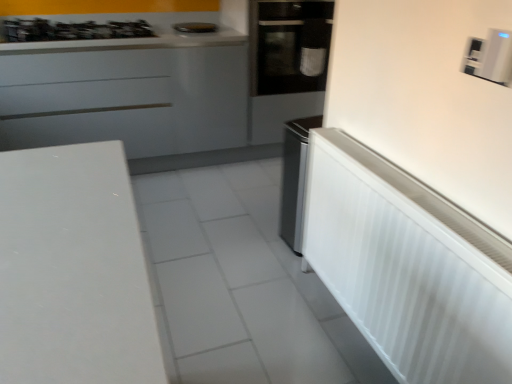
The image size is (512, 384). Identify the location of white plastic radiator at right, positioned as the 3th appliance in top-to-bottom order. (408, 267).

Image resolution: width=512 pixels, height=384 pixels. Describe the element at coordinates (490, 57) in the screenshot. I see `white plastic thermostat at upper right, the third appliance when ordered from left to right` at that location.

In order to face metallic silver gas stove at upper left, should I rotate leftwards or rightwards?

Turn left by 22.820 degrees to look at metallic silver gas stove at upper left.

What do you see at coordinates (72, 30) in the screenshot? This screenshot has height=384, width=512. I see `metallic silver gas stove at upper left` at bounding box center [72, 30].

Identify the location of metallic silver toaster at upper center, the 1th appliance from the left. This screenshot has width=512, height=384. (195, 28).

Locate an element on the screen. This screenshot has height=384, width=512. white plastic radiator at right, which appears as the 1th appliance when ordered from the bottom is located at coordinates (408, 267).

Is white plastic thermostat at upper right, which is the second appliance from front to back, at the left side of white glossy cabinet at upper left?

No.

Is white plastic thermostat at upper right, placed as the 2th appliance when sorted from bottom to top, far away from white glossy cabinet at upper left?

white plastic thermostat at upper right, placed as the 2th appliance when sorted from bottom to top, is far away from white glossy cabinet at upper left.

There is a white glossy cabinet at upper left. Where is `the 1st appliance below it (from the image's perspective)`? Image resolution: width=512 pixels, height=384 pixels. the 1st appliance below it (from the image's perspective) is located at coordinates (490, 57).

Would you say white plastic radiator at right, the third appliance positioned from the back, is outside metallic silver gas stove at upper left?

Yes, white plastic radiator at right, the third appliance positioned from the back, is outside of metallic silver gas stove at upper left.

From their relative heights in the image, would you say white plastic radiator at right, the second appliance in the right-to-left sequence, is taller or shorter than metallic silver gas stove at upper left?

white plastic radiator at right, the second appliance in the right-to-left sequence, is taller than metallic silver gas stove at upper left.

Can you confirm if white plastic radiator at right, the third appliance positioned from the back, is thinner than metallic silver gas stove at upper left?

Correct, the width of white plastic radiator at right, the third appliance positioned from the back, is less than that of metallic silver gas stove at upper left.

Does white plastic radiator at right, the third appliance positioned from the back, appear on the left side of metallic silver gas stove at upper left?

No, white plastic radiator at right, the third appliance positioned from the back, is not to the left of metallic silver gas stove at upper left.

Which object is wider, white plastic radiator at right, the second appliance in the right-to-left sequence, or black glass oven at center?

With larger width is black glass oven at center.

Is the surface of white plastic radiator at right, which appears as the 2th appliance when viewed from the left, in direct contact with black glass oven at center?

They are not placed beside each other.

From the image's perspective, between white plastic radiator at right, positioned as the 3th appliance in top-to-bottom order, and black glass oven at center, who is located below?

white plastic radiator at right, positioned as the 3th appliance in top-to-bottom order, is shown below in the image.

Is metallic silver gas stove at upper left not within white glossy cabinet at upper left?

No, metallic silver gas stove at upper left is not outside of white glossy cabinet at upper left.

Considering the relative positions of metallic silver gas stove at upper left and white glossy cabinet at upper left in the image provided, is metallic silver gas stove at upper left behind white glossy cabinet at upper left?

Yes, metallic silver gas stove at upper left is behind white glossy cabinet at upper left.

Is metallic silver gas stove at upper left oriented towards white glossy cabinet at upper left?

No.

Can you tell me how much black glass oven at center and metallic silver gas stove at upper left differ in facing direction?

The facing directions of black glass oven at center and metallic silver gas stove at upper left are 0.705 degrees apart.

Consider the image. Is black glass oven at center further to camera compared to metallic silver gas stove at upper left?

Yes, black glass oven at center is behind metallic silver gas stove at upper left.

From the image's perspective, is black glass oven at center over metallic silver gas stove at upper left?

Correct, black glass oven at center appears higher than metallic silver gas stove at upper left in the image.

Find the location of a particular element. The height and width of the screenshot is (384, 512). appliance that is the 1st object located below the black glass oven at center (from the image's perspective) is located at coordinates (490, 57).

Are black glass oven at center and white plastic thermostat at upper right, the second appliance positioned from the back, making contact?

No, black glass oven at center is not touching white plastic thermostat at upper right, the second appliance positioned from the back.

Between black glass oven at center and white plastic thermostat at upper right, the second appliance positioned from the back, which one has more height?

With more height is black glass oven at center.

Who is smaller, black glass oven at center or white plastic thermostat at upper right, the second appliance positioned from the back?

Smaller between the two is white plastic thermostat at upper right, the second appliance positioned from the back.

From a real-world perspective, is white plastic thermostat at upper right, which is the second appliance from front to back, physically located above or below metallic silver gas stove at upper left?

white plastic thermostat at upper right, which is the second appliance from front to back, is above metallic silver gas stove at upper left.

Is point (472, 75) in front of point (143, 22)?

Yes, point (472, 75) is closer to viewer.

Is metallic silver gas stove at upper left completely or partially inside white plastic thermostat at upper right, the second appliance in the top-to-bottom sequence?

Actually, metallic silver gas stove at upper left is outside white plastic thermostat at upper right, the second appliance in the top-to-bottom sequence.

Between white plastic thermostat at upper right, the third appliance when ordered from left to right, and metallic silver gas stove at upper left, which one appears on the left side from the viewer's perspective?

metallic silver gas stove at upper left.

Starting from the white glossy cabinet at upper left, which appliance is the 1st one in front? Please provide its 2D coordinates.

[(490, 57)]

Starting from the metallic silver gas stove at upper left, which appliance is the 2nd one to the right? Please provide its 2D coordinates.

[(408, 267)]

Which object lies further to the anchor point white glossy cabinet at upper left, white plastic radiator at right, which appears as the 1th appliance when ordered from the bottom, or white plastic thermostat at upper right, the second appliance in the top-to-bottom sequence?

white plastic thermostat at upper right, the second appliance in the top-to-bottom sequence, lies further to white glossy cabinet at upper left than the other object.

When comparing their distances from white plastic radiator at right, which ranks as the 1th appliance in front-to-back order, does metallic silver gas stove at upper left or metallic silver toaster at upper center, arranged as the third appliance when ordered from the bottom, seem further?

Among the two, metallic silver gas stove at upper left is located further to white plastic radiator at right, which ranks as the 1th appliance in front-to-back order.

Looking at the image, which one is located further to metallic silver toaster at upper center, arranged as the third appliance when ordered from the bottom, white plastic thermostat at upper right, the second appliance positioned from the back, or black glass oven at center?

white plastic thermostat at upper right, the second appliance positioned from the back, is positioned further to the anchor metallic silver toaster at upper center, arranged as the third appliance when ordered from the bottom.

Which object lies nearer to the anchor point white plastic thermostat at upper right, placed as the 1th appliance when sorted from right to left, white glossy cabinet at upper left or white plastic radiator at right, positioned as the 3th appliance in top-to-bottom order?

white plastic radiator at right, positioned as the 3th appliance in top-to-bottom order, is closer to white plastic thermostat at upper right, placed as the 1th appliance when sorted from right to left.

When comparing their distances from white glossy cabinet at upper left, does metallic silver toaster at upper center, the third appliance positioned from the right, or white plastic radiator at right, the third appliance positioned from the back, seem further?

The object further to white glossy cabinet at upper left is white plastic radiator at right, the third appliance positioned from the back.

Estimate the real-world distances between objects in this image. Which object is further from white plastic radiator at right, positioned as the 3th appliance in top-to-bottom order, white glossy cabinet at upper left or white plastic thermostat at upper right, which is the second appliance from front to back?

white glossy cabinet at upper left is further to white plastic radiator at right, positioned as the 3th appliance in top-to-bottom order.

From the picture: Estimate the real-world distances between objects in this image. Which object is further from white plastic radiator at right, which appears as the 1th appliance when ordered from the bottom, white glossy cabinet at upper left or black glass oven at center?

white glossy cabinet at upper left is further to white plastic radiator at right, which appears as the 1th appliance when ordered from the bottom.

Based on their spatial positions, is metallic silver gas stove at upper left or white plastic thermostat at upper right, placed as the 1th appliance when sorted from right to left, further from metallic silver toaster at upper center, the third appliance positioned from the right?

white plastic thermostat at upper right, placed as the 1th appliance when sorted from right to left, is further to metallic silver toaster at upper center, the third appliance positioned from the right.

Image resolution: width=512 pixels, height=384 pixels. Find the location of `cabinetry between white plastic radiator at right, which appears as the 1th appliance when ordered from the bottom, and black glass oven at center in the front-back direction`. cabinetry between white plastic radiator at right, which appears as the 1th appliance when ordered from the bottom, and black glass oven at center in the front-back direction is located at coordinates (127, 99).

Where is `cabinetry between metallic silver gas stove at upper left and metallic silver toaster at upper center, which is the 1th appliance from back to front`? The width and height of the screenshot is (512, 384). cabinetry between metallic silver gas stove at upper left and metallic silver toaster at upper center, which is the 1th appliance from back to front is located at coordinates (127, 99).

This screenshot has height=384, width=512. I want to click on cabinetry located between metallic silver gas stove at upper left and white plastic radiator at right, the third appliance positioned from the back, in the left-right direction, so click(x=127, y=99).

This screenshot has height=384, width=512. What are the coordinates of `gas stove located between white plastic radiator at right, the second appliance in the right-to-left sequence, and metallic silver toaster at upper center, arranged as the third appliance when ordered from the bottom, in the depth direction` in the screenshot? It's located at (72, 30).